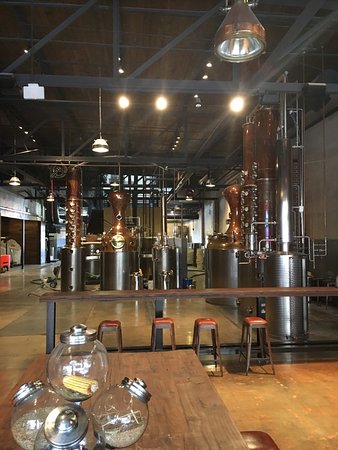
Where is `floor`? The width and height of the screenshot is (338, 450). floor is located at coordinates (265, 397), (26, 337).